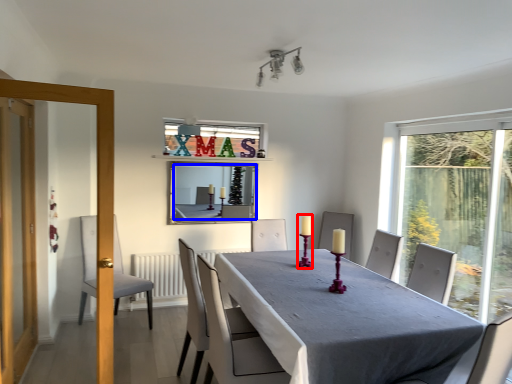
Question: Among these objects, which one is nearest to the camera, candle holder (highlighted by a red box) or mirror (highlighted by a blue box)?

Choices:
 (A) candle holder
 (B) mirror

Answer: (A)